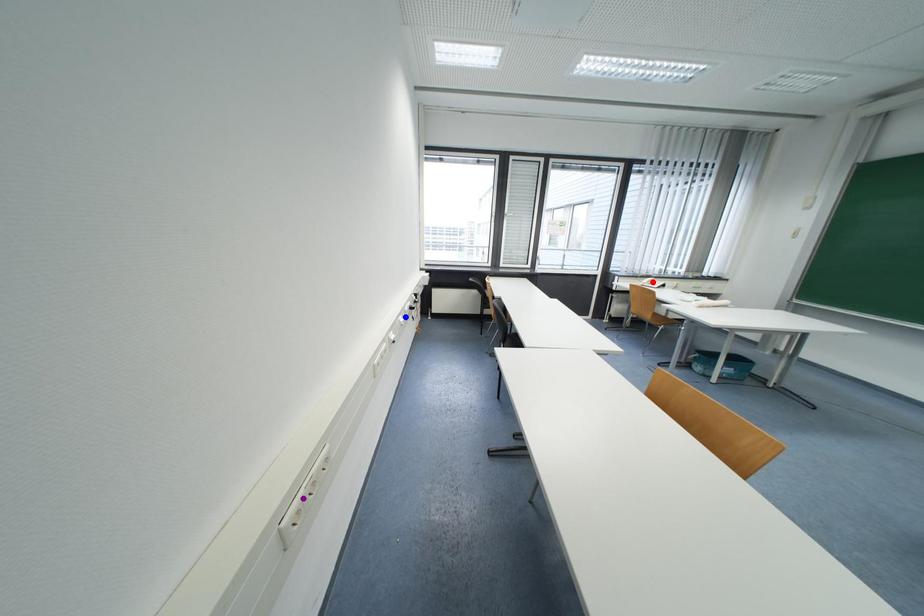
Order these from nearest to farthest:
A) purple point
B) red point
C) blue point

purple point, blue point, red point